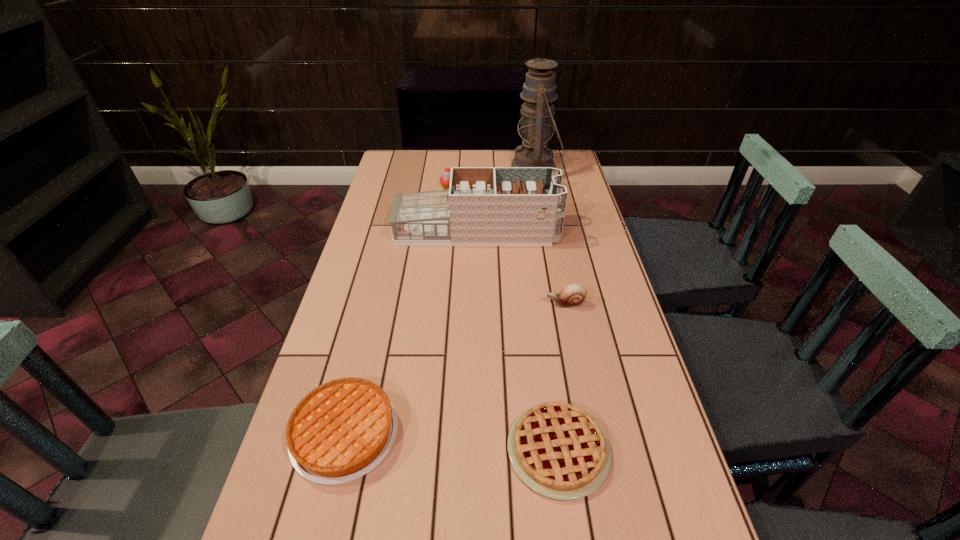
Where is `oil lamp`? This screenshot has width=960, height=540. oil lamp is located at coordinates (537, 122).

Locate an element on the screen. Image resolution: width=960 pixels, height=540 pixels. the fifth shortest object is located at coordinates (483, 206).

Where is `dollhouse`? The height and width of the screenshot is (540, 960). dollhouse is located at coordinates (483, 206).

At what (x,y) coordinates should I click in order to perform the action: click on cupcake. Please return your answer as a coordinate pair (x, y). Looking at the image, I should click on pyautogui.click(x=445, y=178).

This screenshot has width=960, height=540. I want to click on the fourth farthest object, so click(573, 295).

Image resolution: width=960 pixels, height=540 pixels. What are the coordinates of `the fourth tallest object` in the screenshot? It's located at (573, 295).

Where is `the second shortest object`? the second shortest object is located at coordinates (341, 430).

You are a GUI agent. You are given a task and a screenshot of the screen. Output one action in this format:
    pyautogui.click(x=<x>, y=<y>)
    Task: Click on the taller pie
    
    Given the screenshot: What is the action you would take?
    pyautogui.click(x=341, y=430)

Find the location of a particular element. This screenshot has height=540, width=960. the shorter pie is located at coordinates pyautogui.click(x=558, y=450).

This screenshot has height=540, width=960. Find the location of `the shortest object`. the shortest object is located at coordinates (558, 450).